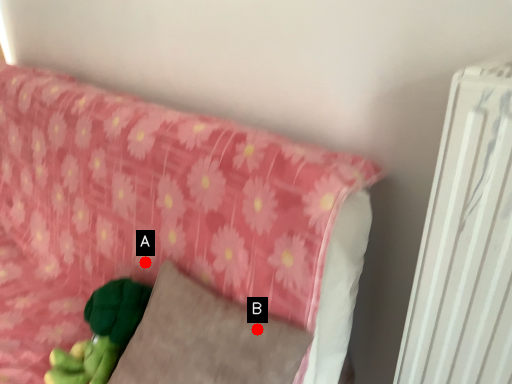
Question: Two points are circled on the image, labeled by A and B beside each circle. Which point is farther to the camera?

Choices:
 (A) A is further
 (B) B is further

Answer: (A)